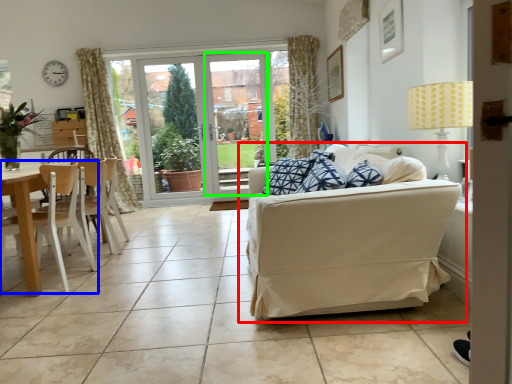
Question: Considering the real-world distances, which object is closest to studio couch (highlighted by a red box)? chair (highlighted by a blue box) or window screen (highlighted by a green box).

Choices:
 (A) chair
 (B) window screen

Answer: (A)